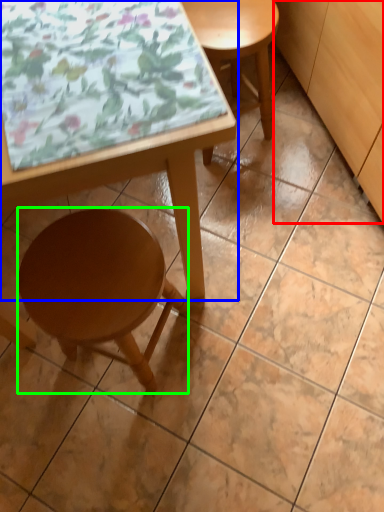
Question: Considering the real-world distances, which object is closest to cabinetry (highlighted by a red box)? table (highlighted by a blue box) or stool (highlighted by a green box).

Choices:
 (A) table
 (B) stool

Answer: (A)